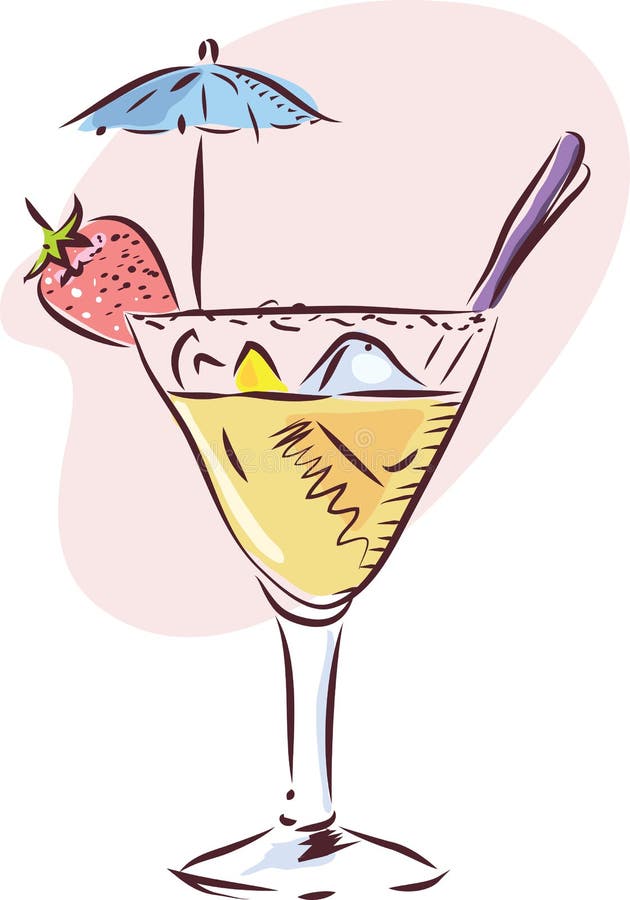
This screenshot has width=630, height=900. Identify the location of glass. (411, 336).